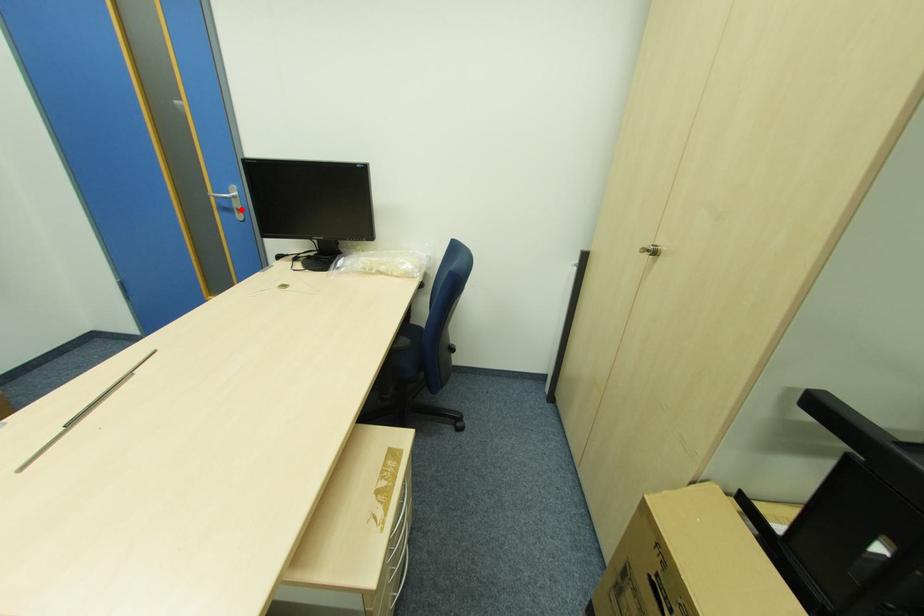
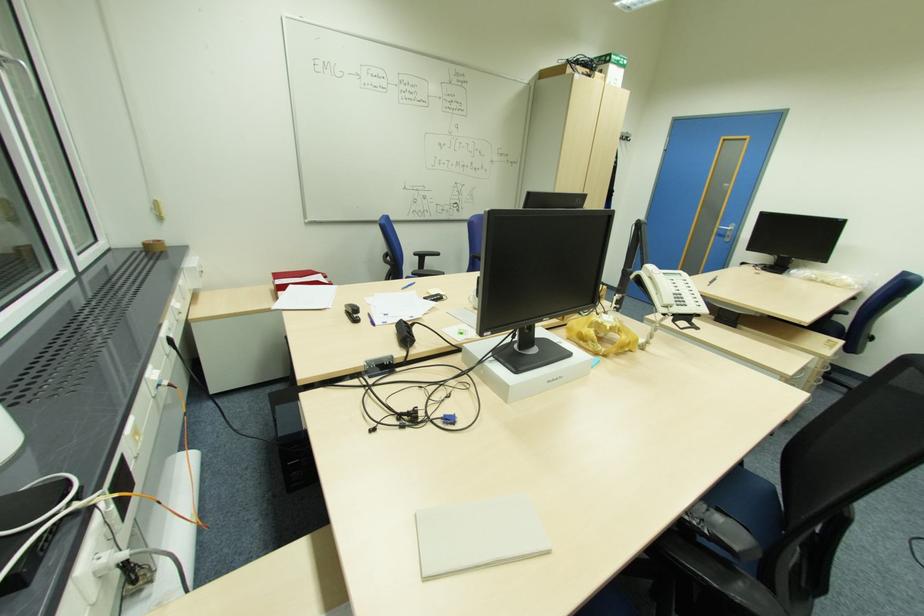
In the second image, find the point that corresponds to the highlighted location in the first image.

(732, 236)